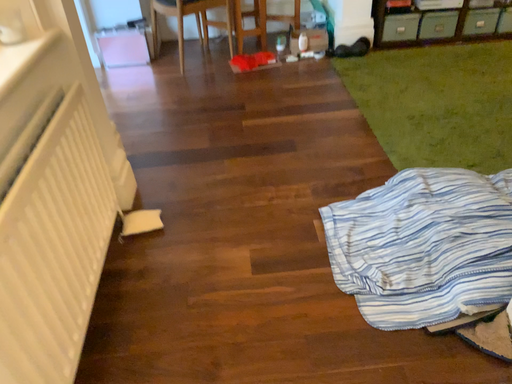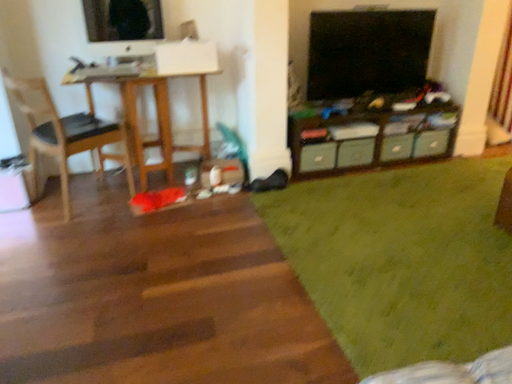
Question: Which way did the camera rotate in the video?

Choices:
 (A) rotated downward
 (B) rotated upward

Answer: (B)